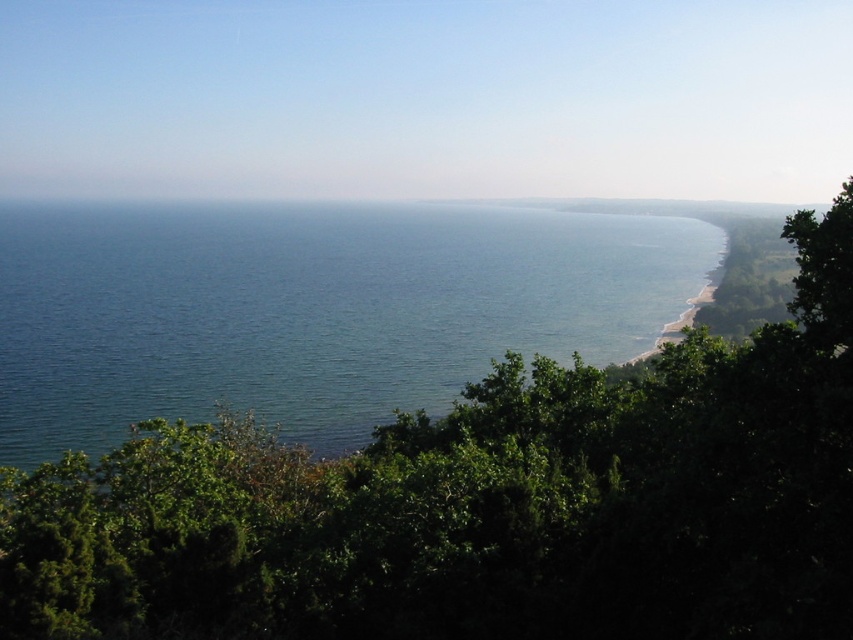
Is blue water at center above green leafy tree at right?

Yes, blue water at center is above green leafy tree at right.

Is blue water at center bigger than green leafy tree at right?

Yes, blue water at center is bigger than green leafy tree at right.

Between point (195, 305) and point (822, 282), which one is positioned behind?

Positioned behind is point (195, 305).

Locate an element on the screen. This screenshot has height=640, width=853. blue water at center is located at coordinates (310, 310).